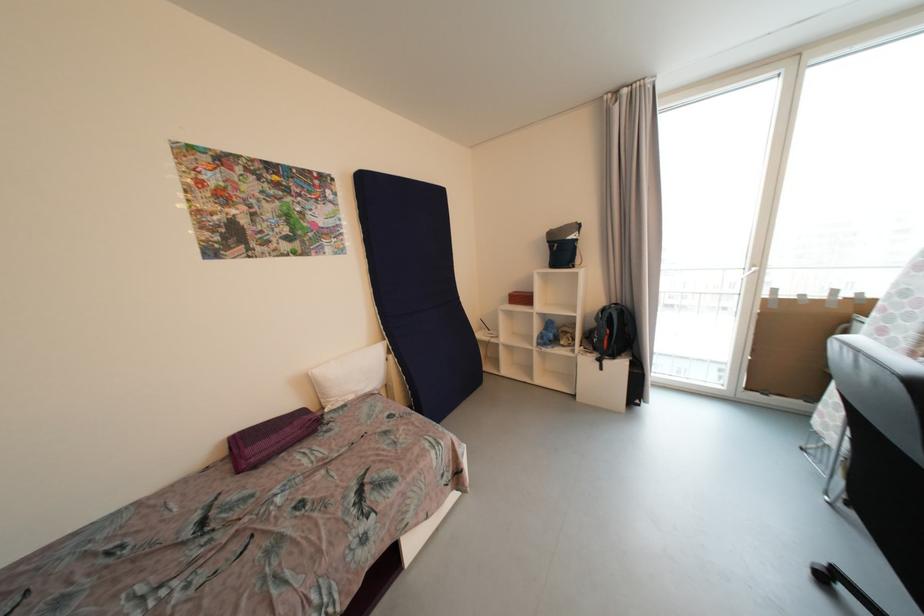
The location [520,298] corresponds to which object?

It refers to a red wicker box.